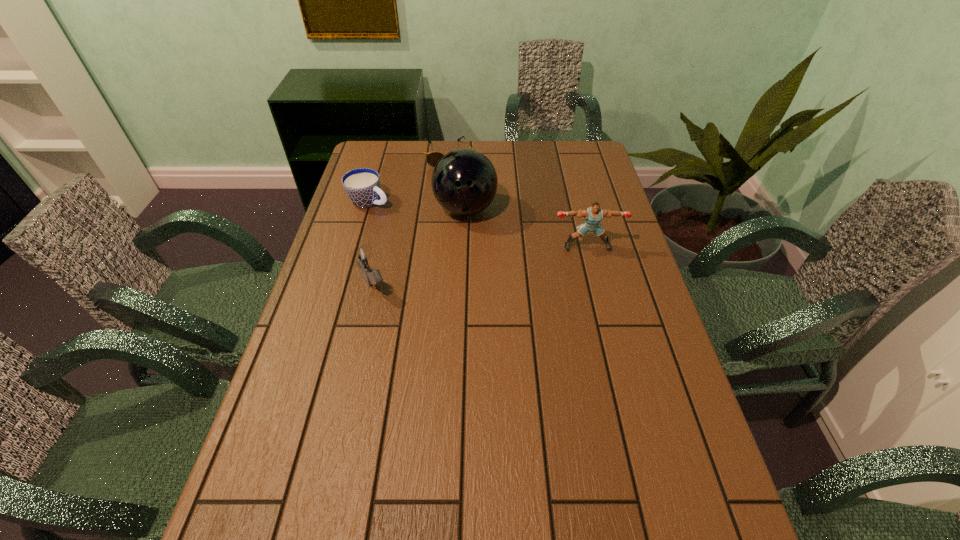
Identify which object is located as the third nearest to the sunglasses. Please provide its 2D coordinates. Your answer should be formatted as a tuple, i.e. [(x, y)], where the tuple contains the x and y coordinates of a point satisfying the conditions above.

[(593, 215)]

The width and height of the screenshot is (960, 540). What are the coordinates of `the second closest object relative to the shortest object` in the screenshot? It's located at coord(362,186).

The height and width of the screenshot is (540, 960). I want to click on free point that satisfies the following two spatial constraints: 1. on the back side of the sunglasses; 2. on the left side of the second shortest object, so click(x=383, y=154).

Locate an element on the screen. This screenshot has height=540, width=960. free space that satisfies the following two spatial constraints: 1. on the back side of the second shortest object; 2. on the left side of the farthest object is located at coordinates (383, 154).

Find the location of `vacant position in the image that satisfies the following two spatial constraints: 1. on the back side of the second shortest object; 2. on the left side of the shortest object`. vacant position in the image that satisfies the following two spatial constraints: 1. on the back side of the second shortest object; 2. on the left side of the shortest object is located at coordinates (383, 154).